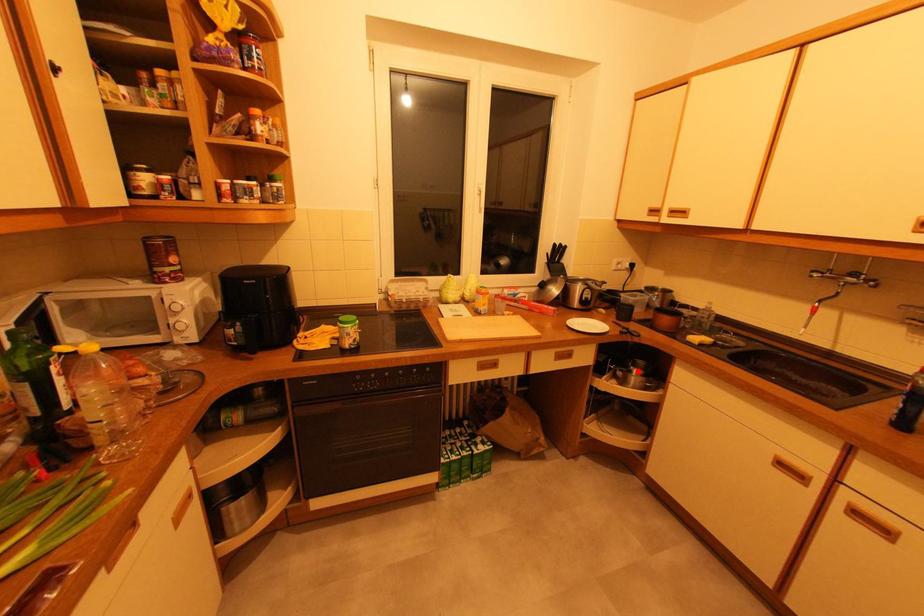
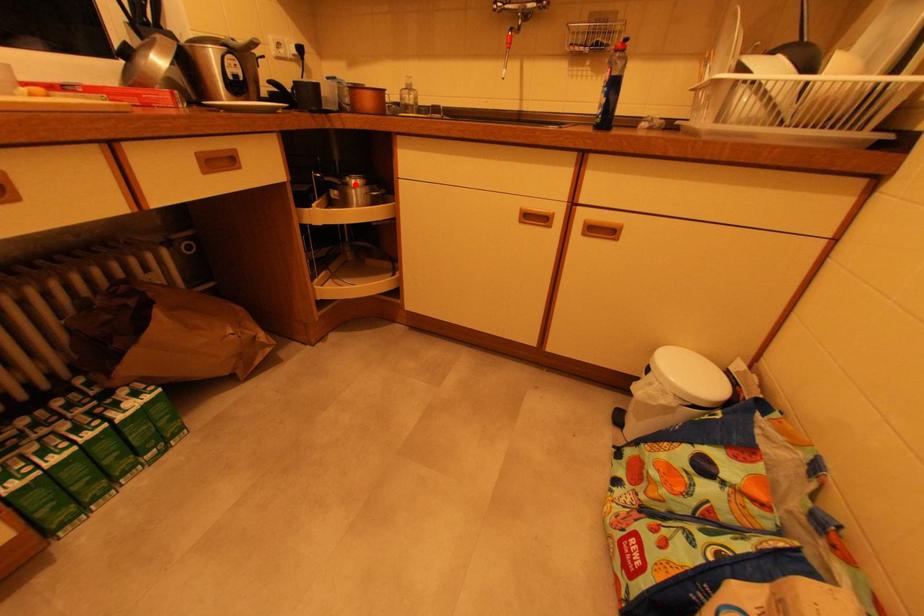
I am providing you with two images of the same scene from different viewpoints. A red point is marked on the first image and another point is marked on the second image. Is the red point in image1 aligned with the point shown in image2?

Yes